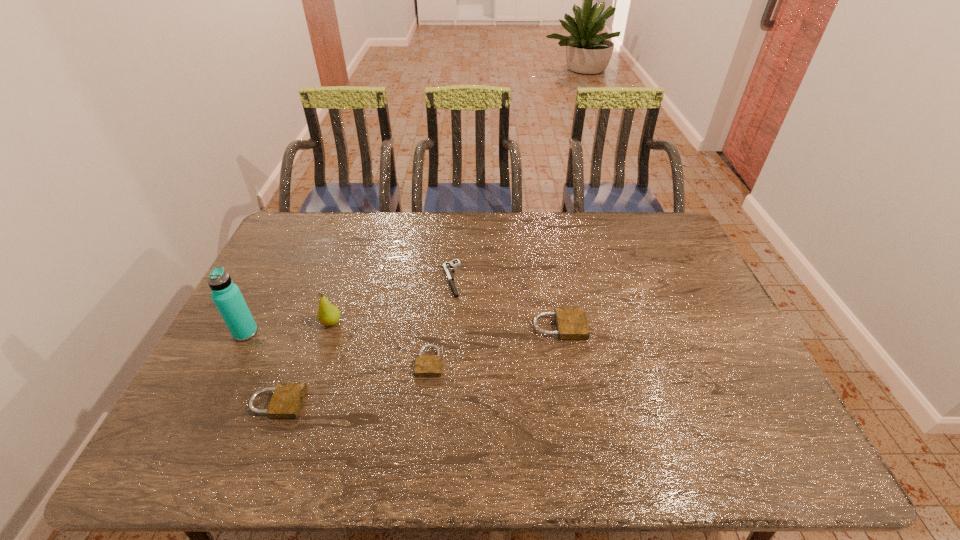
Locate an element on the screen. the leftmost object is located at coordinates (227, 297).

The width and height of the screenshot is (960, 540). Identify the location of vacant space located 0.130m on the keyhole side of the nearest padlock. (355, 403).

In order to click on free region located on the keyhole side of the shortest padlock in this screenshot , I will do `click(424, 412)`.

Find the location of `free space located 0.200m on the keyhole side of the fourth shortest object`. free space located 0.200m on the keyhole side of the fourth shortest object is located at coordinates (655, 327).

Where is `vacant space situated on the right of the second tallest object`? The height and width of the screenshot is (540, 960). vacant space situated on the right of the second tallest object is located at coordinates (428, 322).

You are a GUI agent. You are given a task and a screenshot of the screen. Output one action in this format:
    pyautogui.click(x=<x>, y=<y>)
    Task: Click on the blank space located on the front-facing side of the farthest object
    The height and width of the screenshot is (540, 960).
    Given the screenshot: What is the action you would take?
    pyautogui.click(x=326, y=279)

The image size is (960, 540). Find the location of `free region located on the front-facing side of the farthest object`. free region located on the front-facing side of the farthest object is located at coordinates (404, 279).

The height and width of the screenshot is (540, 960). Identify the location of vacant space located 0.330m on the front-facing side of the farthest object. (339, 279).

Where is `vacant space located on the right of the tallest object`? This screenshot has height=540, width=960. vacant space located on the right of the tallest object is located at coordinates (324, 333).

I want to click on object positioned at the near edge, so click(287, 399).